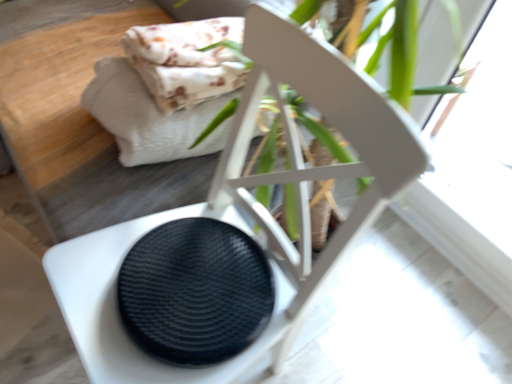
Find the location of a particular element. vacant region above black mesh shoe at center (from a real-world perspective) is located at coordinates (187, 280).